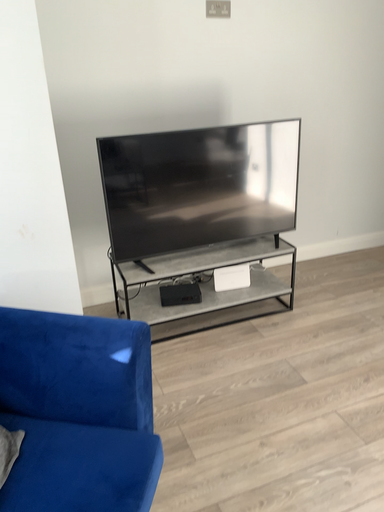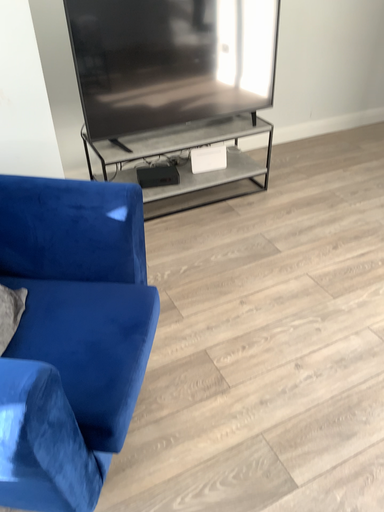
Question: How did the camera likely rotate when shooting the video?

Choices:
 (A) rotated upward
 (B) rotated downward

Answer: (B)